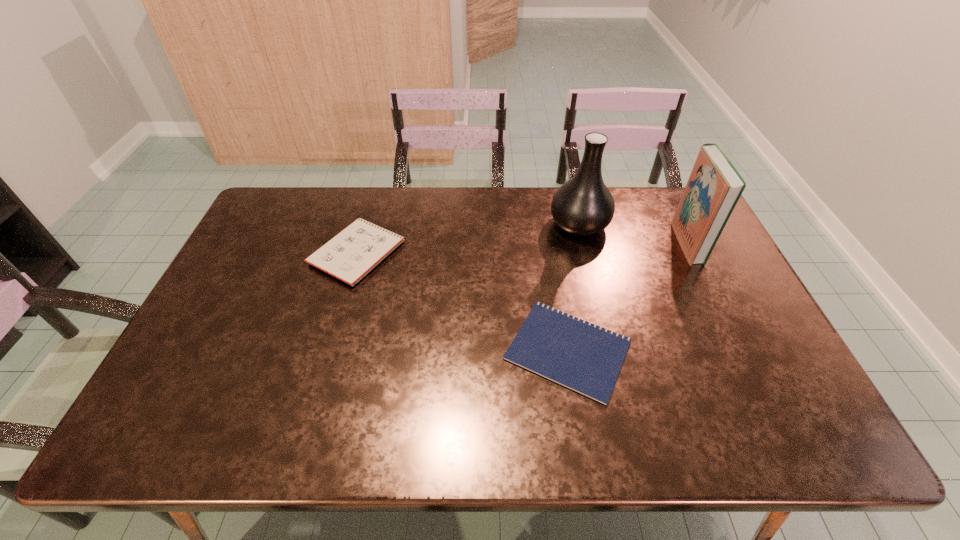
Locate an element on the screen. Image resolution: width=960 pixels, height=540 pixels. vacant space at the right edge of the desktop is located at coordinates (707, 323).

You are a GUI agent. You are given a task and a screenshot of the screen. Output one action in this format:
    pyautogui.click(x=<x>, y=<y>)
    Task: Click on the vacant space at the far left corner of the desktop
    
    Given the screenshot: What is the action you would take?
    pyautogui.click(x=281, y=219)

Where is `empty space that is in between the shorter notepad and the rightmost object`? The image size is (960, 540). empty space that is in between the shorter notepad and the rightmost object is located at coordinates (628, 296).

Locate an element on the screen. This screenshot has height=540, width=960. vacant space that is in between the farther notepad and the hardback book is located at coordinates (522, 247).

This screenshot has height=540, width=960. What are the coordinates of `empty location between the rightmost object and the taller notepad` in the screenshot? It's located at (522, 247).

Locate an element on the screen. Image resolution: width=960 pixels, height=540 pixels. vacant area that lies between the third tallest object and the nearest object is located at coordinates (463, 301).

Find the location of `free space between the nearest object and the leftmost object`. free space between the nearest object and the leftmost object is located at coordinates (463, 301).

I want to click on vacant region between the hardback book and the leftmost object, so click(522, 247).

Locate an element on the screen. The width and height of the screenshot is (960, 540). free spot between the vase and the nearer notepad is located at coordinates (573, 287).

Image resolution: width=960 pixels, height=540 pixels. Identify the location of vacant area between the shortest object and the rightmost object. (628, 296).